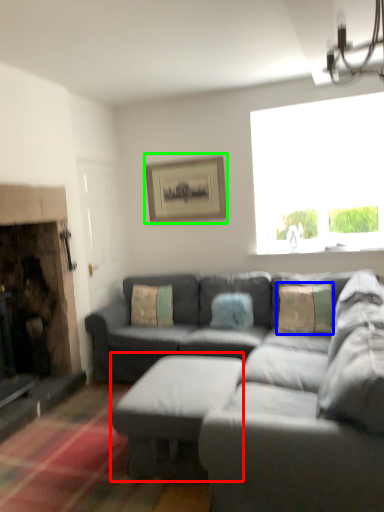
Question: Based on their relative distances, which object is farther from table (highlighted by a red box)? Choose from pillow (highlighted by a blue box) and picture frame (highlighted by a green box).

Choices:
 (A) pillow
 (B) picture frame

Answer: (B)